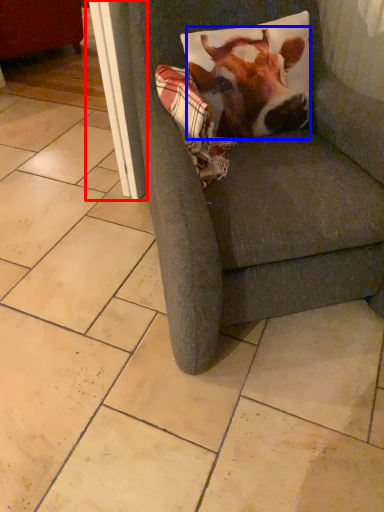
Question: Which of the following is the closest to the observer, screen door (highlighted by a red box) or cattle (highlighted by a blue box)?

Choices:
 (A) screen door
 (B) cattle

Answer: (B)